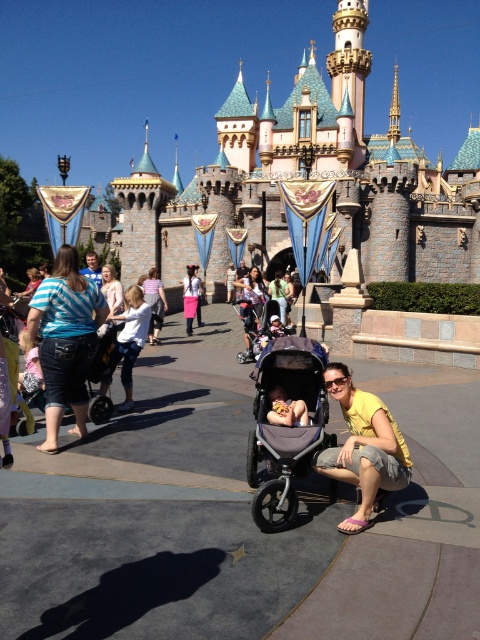
Consider the image. Who is taller, pink stone castle at center or matte pink shirt at center?

pink stone castle at center is taller.

Does pink stone castle at center appear on the left side of matte pink shirt at center?

No, pink stone castle at center is not to the left of matte pink shirt at center.

The image size is (480, 640). What are the coordinates of `pink stone castle at center` in the screenshot? It's located at (333, 204).

Does yellow cotton shirt at lower center have a greater height compared to pink fabric skirt at center?

Yes.

Who is positioned more to the left, yellow cotton shirt at lower center or pink fabric skirt at center?

Positioned to the left is pink fabric skirt at center.

What are the coordinates of `yellow cotton shirt at lower center` in the screenshot? It's located at (363, 445).

Between point (259, 202) and point (188, 276), which one is positioned in front?

Positioned in front is point (188, 276).

Is pink stone castle at center wider than pink fabric skirt at center?

Yes.

Between point (179, 276) and point (187, 292), which one is positioned behind?

The point (179, 276) is behind.

Locate an element on the screen. Image resolution: width=480 pixels, height=640 pixels. pink stone castle at center is located at coordinates (333, 204).